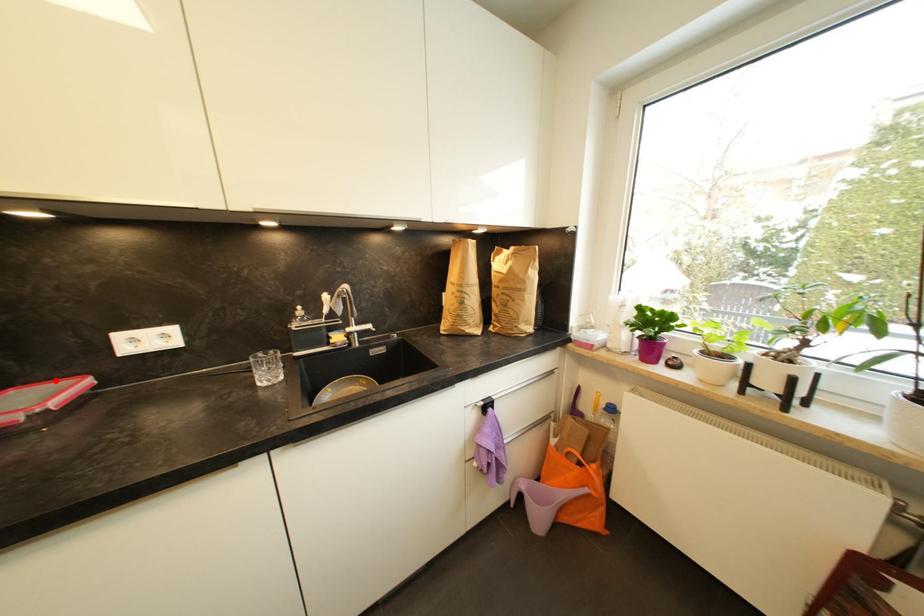
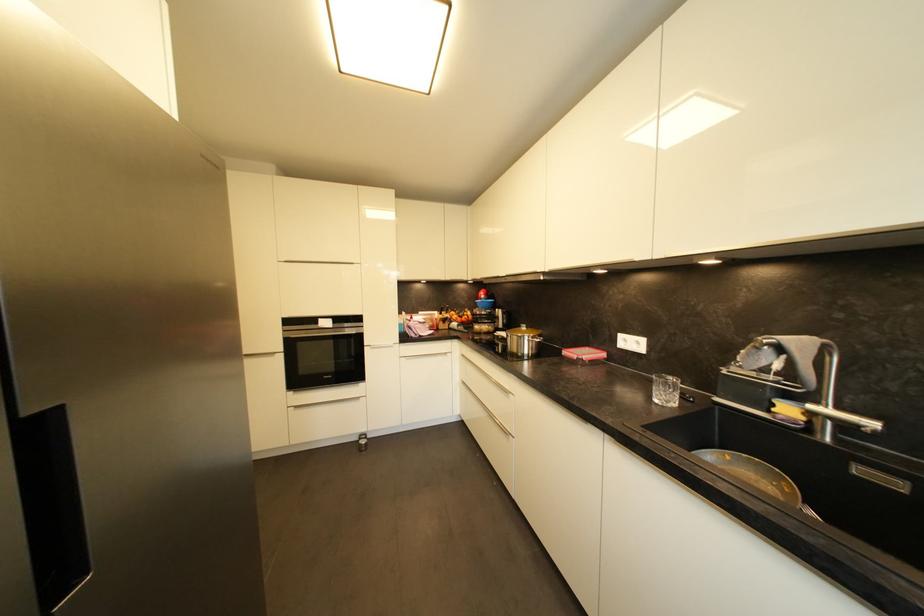
Find the pixel in the second image that matches the highlighted location in the first image.

(602, 350)